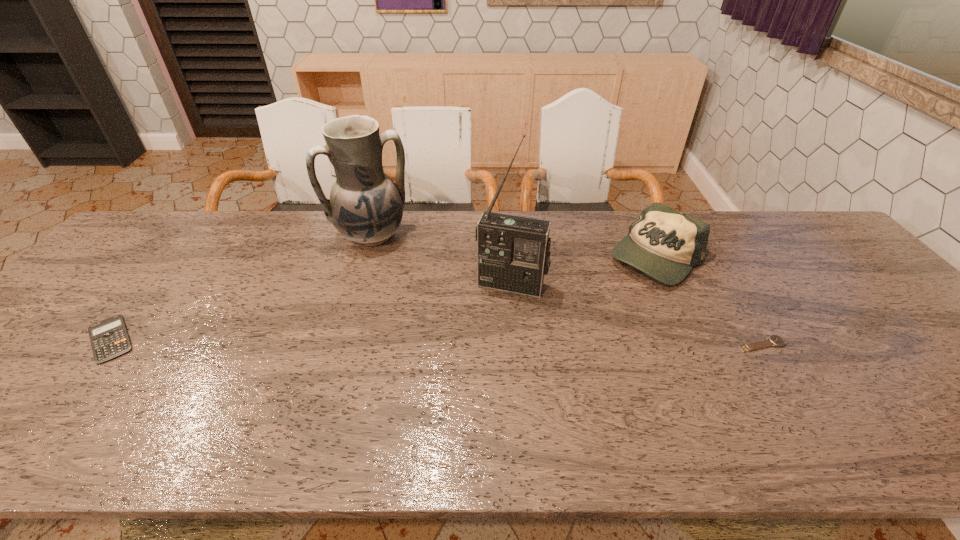
Where is `calculator`? This screenshot has height=540, width=960. calculator is located at coordinates (109, 338).

Locate an element on the screen. The width and height of the screenshot is (960, 540). watch is located at coordinates (774, 340).

This screenshot has width=960, height=540. Find the location of `the third shortest object`. the third shortest object is located at coordinates (665, 244).

Find the location of `radio receiver`. radio receiver is located at coordinates (513, 253).

I want to click on the fourth shortest object, so click(365, 206).

The image size is (960, 540). In order to click on the fourth object from right to left in this screenshot , I will do `click(365, 206)`.

Image resolution: width=960 pixels, height=540 pixels. Identify the location of free space located on the right of the leftmost object. (203, 339).

Find the location of `blank space located 0.120m on the right of the watch`. blank space located 0.120m on the right of the watch is located at coordinates (837, 345).

I want to click on vacant space located on the front-facing side of the third tallest object, so click(x=589, y=300).

The image size is (960, 540). What are the coordinates of `vacant position located on the front-facing side of the third tallest object` in the screenshot? It's located at (587, 301).